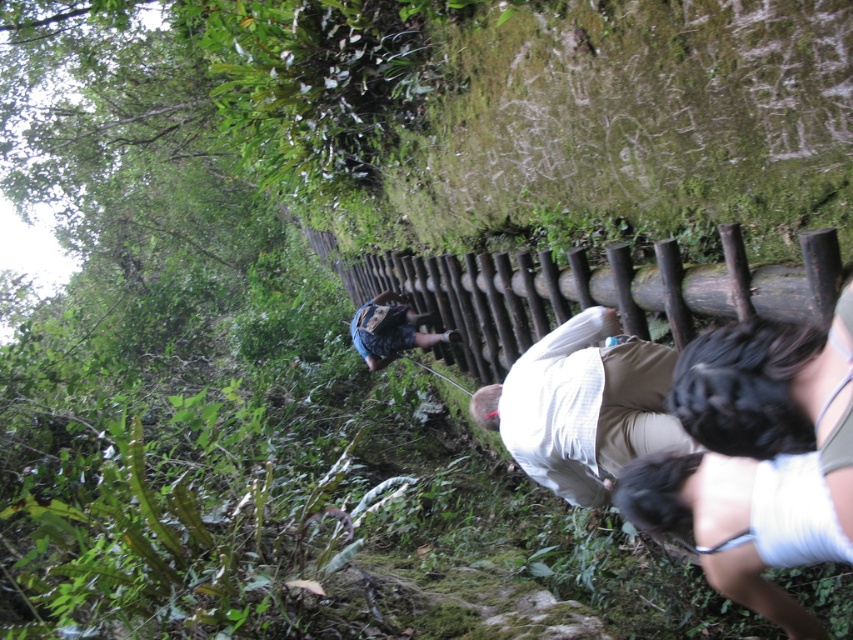
You are a hiker carrying a backpack and need to pass through the narrow wooden staircase. You notice a white cotton shirt at center and a blue denim shorts at center. Given that your backpack is 10 feet wide, can you safely walk between these two items without hitting your backpack against them?

The white cotton shirt at center and blue denim shorts at center are 9.50 feet apart from each other. Since your backpack is 10 feet wide, which is slightly wider than the gap between them, you cannot safely pass through without risking contact between your backpack and the items.

You are standing on the staircase and want to move towards the direction of the staircase. Which of the two points, point (767, 356) or point (570, 483), should you step on first?

Point (767, 356) is in front of point (570, 483), so you should step on point (767, 356) first to move in the direction of the staircase.

You are a hiker navigating a narrow wooden staircase in a dense forest. You notice a brown wooden fence at center and blue denim shorts at center. Which object is located to the right of the other?

The brown wooden fence at center is positioned on the right side of blue denim shorts at center.